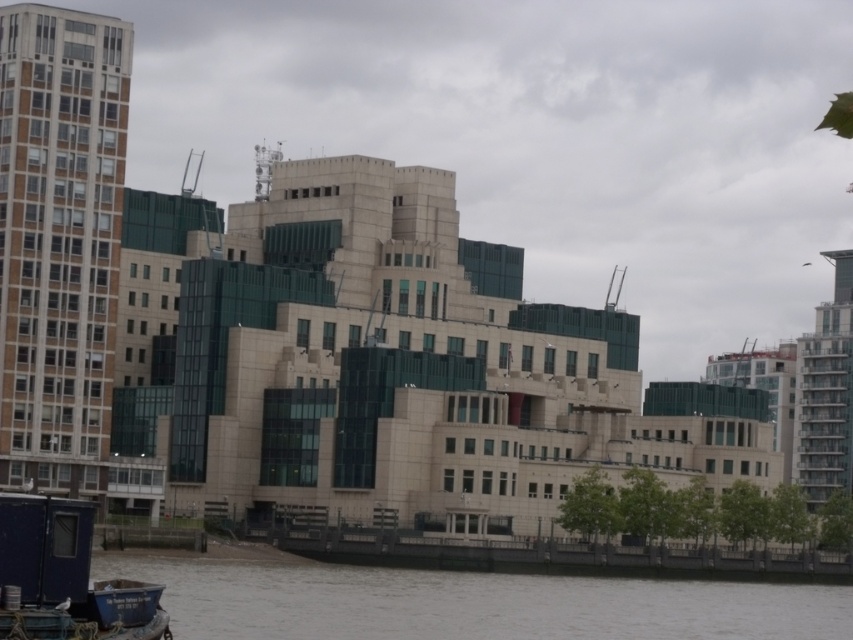
Describe the element at coordinates (468, 602) in the screenshot. I see `brown water at lower left` at that location.

Is brown water at lower left to the left of blue painted wood boat at lower left from the viewer's perspective?

No, brown water at lower left is not to the left of blue painted wood boat at lower left.

Find the location of `brown water at lower left`. brown water at lower left is located at coordinates (468, 602).